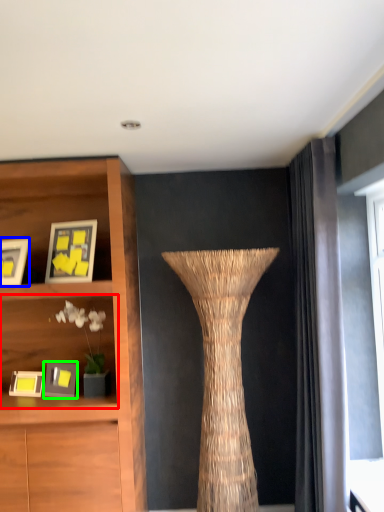
Question: Which object is positioned closest to shelf (highlighted by a red box)? Select from picture frame (highlighted by a blue box) and picture frame (highlighted by a green box).

Choices:
 (A) picture frame
 (B) picture frame

Answer: (B)